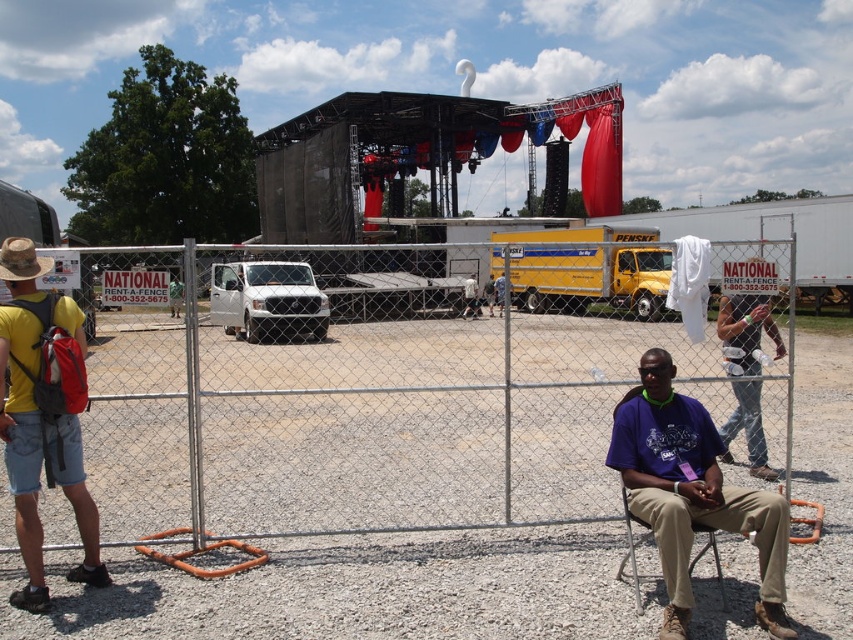
Measure the distance between metallic silver chair at center and camera.

3.90 meters

Is metallic silver chair at center taller than brown felt cowboy hat at left?

Yes.

Does point (640, 602) come in front of point (9, 266)?

No.

You are a GUI agent. You are given a task and a screenshot of the screen. Output one action in this format:
    pyautogui.click(x=<x>, y=<y>)
    Task: Click on the metallic silver chair at center
    The height and width of the screenshot is (640, 853).
    Given the screenshot: What is the action you would take?
    pyautogui.click(x=630, y=532)

Is purple cotton shirt at center smaller than brown felt cowboy hat at left?

Actually, purple cotton shirt at center might be larger than brown felt cowboy hat at left.

What do you see at coordinates (691, 493) in the screenshot? I see `purple cotton shirt at center` at bounding box center [691, 493].

Is point (675, 618) closer to viewer compared to point (9, 252)?

That is True.

Where is `purple cotton shirt at center`? This screenshot has height=640, width=853. purple cotton shirt at center is located at coordinates (691, 493).

Does point (741, 413) come behind point (634, 588)?

Yes, it is.

Based on the photo, can you confirm if denim jeans at right is smaller than metallic silver chair at center?

No, denim jeans at right is not smaller than metallic silver chair at center.

Identify the location of denim jeans at right. The image size is (853, 640). (746, 332).